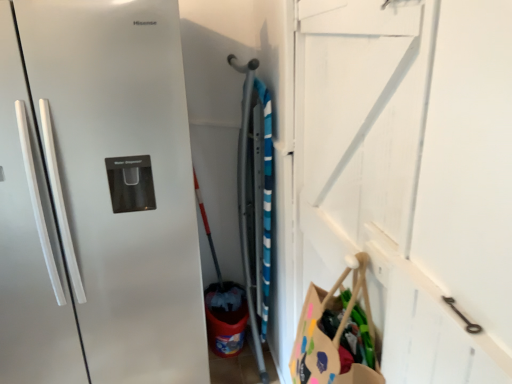
Question: Is white wooden door at upper right positioned before satin white refrigerator handles at left?

Choices:
 (A) yes
 (B) no

Answer: (B)

Question: From the image's perspective, does white wooden door at upper right appear lower than satin white refrigerator handles at left?

Choices:
 (A) yes
 (B) no

Answer: (B)

Question: Does white wooden door at upper right have a greater width compared to satin white refrigerator handles at left?

Choices:
 (A) yes
 (B) no

Answer: (A)

Question: Can you confirm if white wooden door at upper right is bigger than satin white refrigerator handles at left?

Choices:
 (A) no
 (B) yes

Answer: (B)

Question: Does white wooden door at upper right have a greater height compared to satin white refrigerator handles at left?

Choices:
 (A) yes
 (B) no

Answer: (A)

Question: From a real-world perspective, is white wooden door at upper right physically above satin white refrigerator handles at left?

Choices:
 (A) yes
 (B) no

Answer: (B)

Question: Are satin white refrigerator handles at left and white wooden door at upper right far apart?

Choices:
 (A) no
 (B) yes

Answer: (B)

Question: Does satin white refrigerator handles at left come behind white wooden door at upper right?

Choices:
 (A) no
 (B) yes

Answer: (A)

Question: From the image's perspective, is satin white refrigerator handles at left on white wooden door at upper right?

Choices:
 (A) no
 (B) yes

Answer: (A)

Question: Is satin white refrigerator handles at left bigger than white wooden door at upper right?

Choices:
 (A) no
 (B) yes

Answer: (A)

Question: Can you confirm if satin white refrigerator handles at left is taller than white wooden door at upper right?

Choices:
 (A) yes
 (B) no

Answer: (B)

Question: Does satin white refrigerator handles at left have a lesser width compared to white wooden door at upper right?

Choices:
 (A) no
 (B) yes

Answer: (B)

Question: Is white wooden door at upper right wider or thinner than satin white refrigerator handles at left?

Choices:
 (A) wide
 (B) thin

Answer: (A)